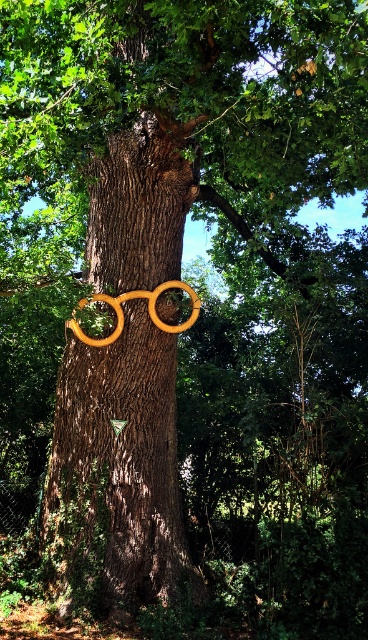
Which is more to the right, brown rough tree trunk at center or wooden hula hoop at center?

Positioned to the right is brown rough tree trunk at center.

Who is more forward, (114, 554) or (115, 312)?

Point (114, 554)

Does point (47, 536) come behind point (182, 326)?

That is True.

Locate an element on the screen. brown rough tree trunk at center is located at coordinates (118, 470).